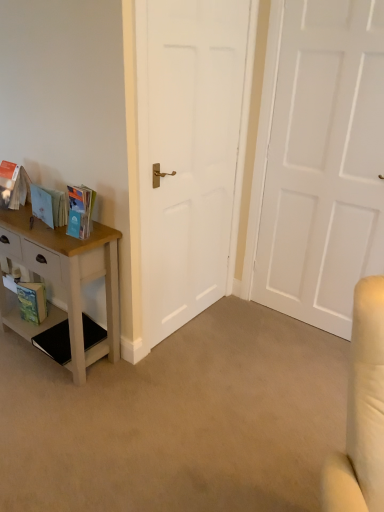
This screenshot has width=384, height=512. I want to click on vacant area situated to the left side of matte blue book at left, positioned as the 1th book in right-to-left order, so click(x=51, y=234).